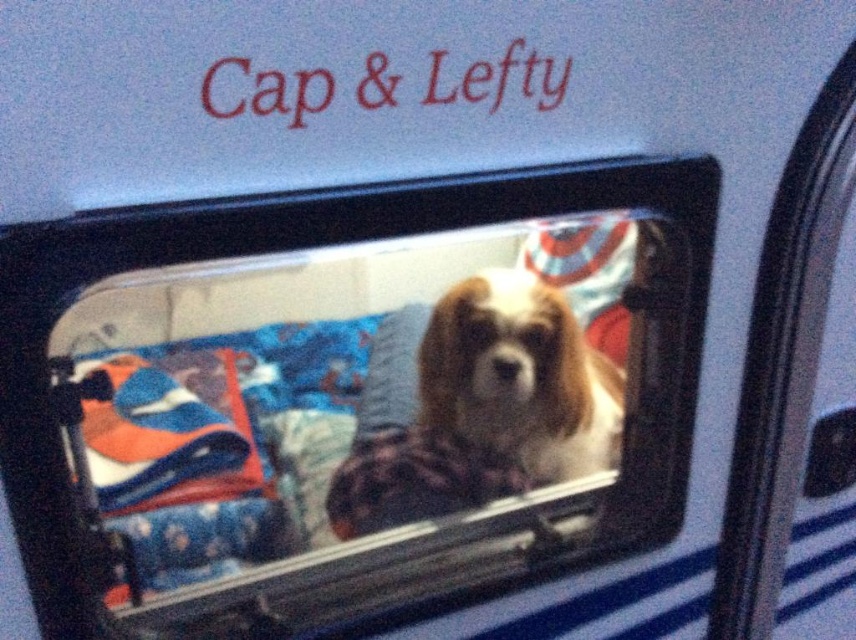
Question: Is clear glass dog at center to the right of white fur dog at center from the viewer's perspective?

Choices:
 (A) no
 (B) yes

Answer: (A)

Question: Which object is closer to the camera taking this photo?

Choices:
 (A) white fur dog at center
 (B) clear glass dog at center

Answer: (B)

Question: Can you confirm if clear glass dog at center is thinner than white fur dog at center?

Choices:
 (A) no
 (B) yes

Answer: (A)

Question: Which point appears farthest from the camera in this image?

Choices:
 (A) (599, 342)
 (B) (538, 348)

Answer: (A)

Question: Is clear glass dog at center closer to camera compared to white fur dog at center?

Choices:
 (A) no
 (B) yes

Answer: (B)